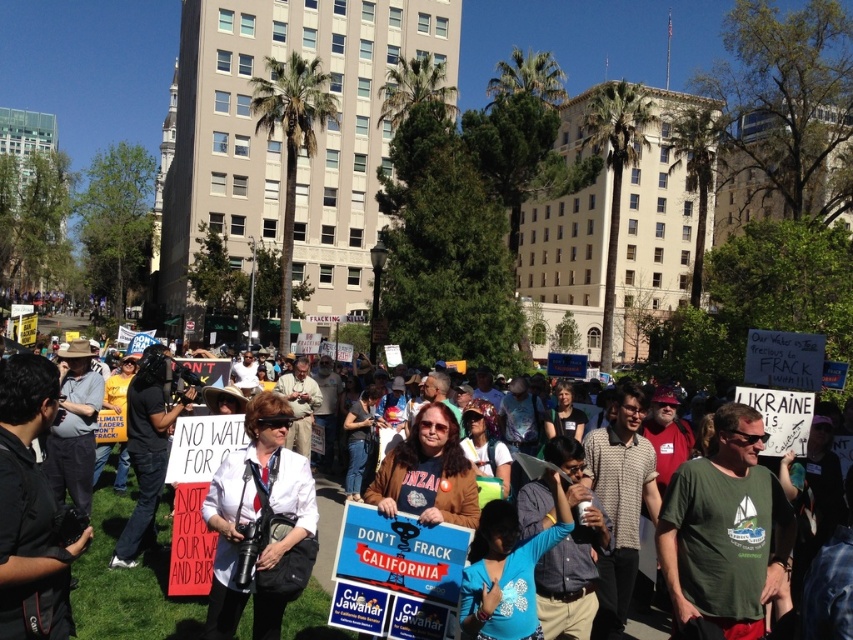
You are standing in the park and see two people wearing white shirts at the center of the protest. Which person is closer to you, the one wearing the white fabric shirt at center or the white matte shirt at center?

The white fabric shirt at center is closer to the viewer than the white matte shirt at center, so the person wearing the white fabric shirt at center is closer to you.

You are a photographer at the demonstration and want to capture both the white fabric shirt at center and the white matte shirt at center in a single shot. Which shirt should you position to the left side of your frame to include both?

You should position the white fabric shirt at center to the left side of your frame because it is already to the left of the white matte shirt at center in the scene.

You are a photographer at the protest and want to capture a clear shot of both the white fabric shirt at center and the white matte shirt at center. Since you want both shirts to be visible in the frame, which one should you focus on to ensure the taller one is in focus?

You should focus on the white fabric shirt at center because it has a greater height compared to the white matte shirt at center, ensuring the taller one is in focus.